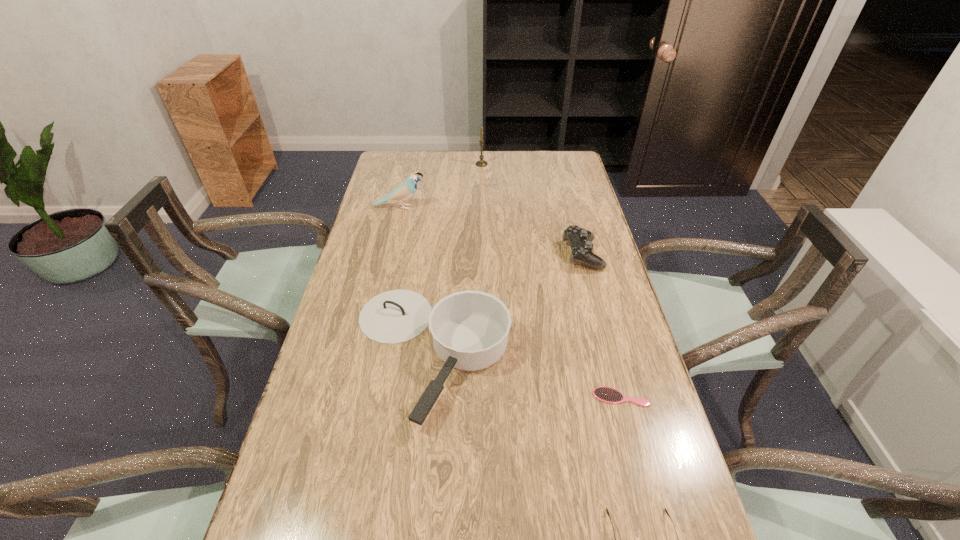
Identify the location of unoccupied area between the third tallest object and the hairbrush. This screenshot has width=960, height=540. (525, 375).

Locate an element on the screen. unoccupied position between the control and the candle is located at coordinates (532, 210).

Locate an element on the screen. vacant area that lies between the shortest object and the third shortest object is located at coordinates (602, 326).

The width and height of the screenshot is (960, 540). Find the location of `vacant point located between the fourth shortest object and the shortest object`. vacant point located between the fourth shortest object and the shortest object is located at coordinates (525, 375).

You are a GUI agent. You are given a task and a screenshot of the screen. Output one action in this format:
    pyautogui.click(x=<x>, y=<y>)
    Task: Click on the unoccupied area between the saucepan and the hairbrush
    
    Given the screenshot: What is the action you would take?
    pyautogui.click(x=525, y=375)

You are a GUI agent. You are given a task and a screenshot of the screen. Output one action in this format:
    pyautogui.click(x=<x>, y=<y>)
    Task: Click on the vacant area that lies between the control and the fifth nearest object
    
    Given the screenshot: What is the action you would take?
    pyautogui.click(x=491, y=231)

This screenshot has width=960, height=540. I want to click on free spot between the shortest object and the fourth shortest object, so click(525, 375).

I want to click on object that stands as the fourth closest to the third farthest object, so click(481, 163).

I want to click on the closest object to the bird, so click(481, 163).

Find the location of a particular element. Image resolution: width=960 pixels, height=540 pixels. free location that satisfies the following two spatial constraints: 1. on the back side of the farthest object; 2. on the left side of the saucepan is located at coordinates (449, 164).